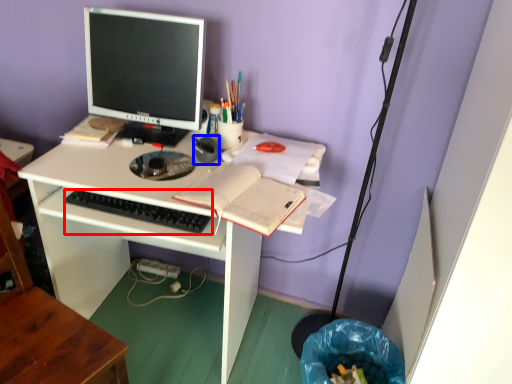
Question: Among these objects, which one is nearest to the camera, computer keyboard (highlighted by a red box) or stationery (highlighted by a blue box)?

Choices:
 (A) computer keyboard
 (B) stationery

Answer: (A)